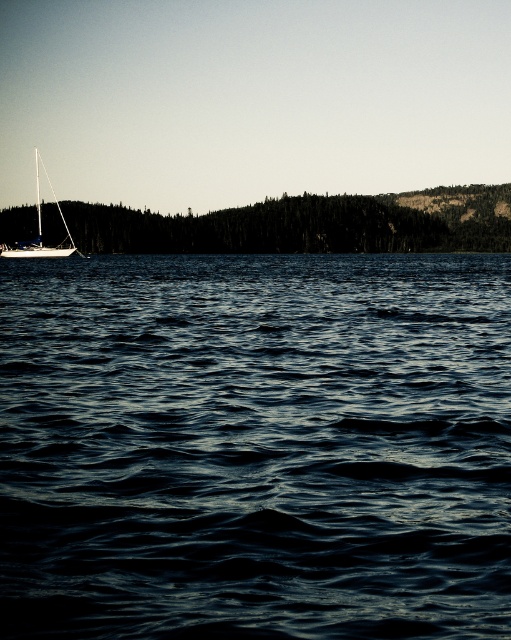
You are standing at the point labeled point (2, 230) and want to reach the point labeled point (369, 499). Which direction should you move to get closer to your destination?

You should move forward because point (369, 499) is in front of point (2, 230).

In the scene shown: You are standing at the lakeside and want to walk from the green matte tree at left to the white matte sailboat at left. Which direction should you move to get closer to the sailboat?

You should move away from the green matte tree at left towards the water since the white matte sailboat at left is farther away from you than the tree.

You are an artist planning to paint the scene. You want to ensure the dark blue water at center and the white matte sailboat at left are proportionally accurate. Which object should you paint first to maintain the correct size relationship between them?

You should paint the white matte sailboat at left first because it occupies more space in the image than the dark blue water at center, according to the description.